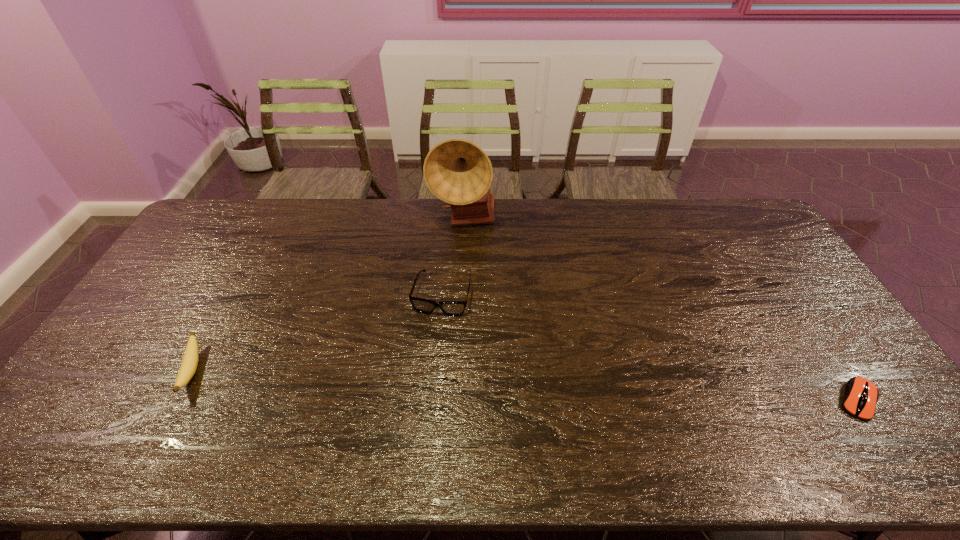
Identify the location of vacant position in the image that satisfies the following two spatial constraints: 1. on the back side of the tallest object; 2. on the right side of the second shortest object. Image resolution: width=960 pixels, height=540 pixels. (273, 220).

The image size is (960, 540). I want to click on vacant space that satisfies the following two spatial constraints: 1. on the back side of the phonograph record; 2. on the left side of the second farthest object, so click(x=448, y=220).